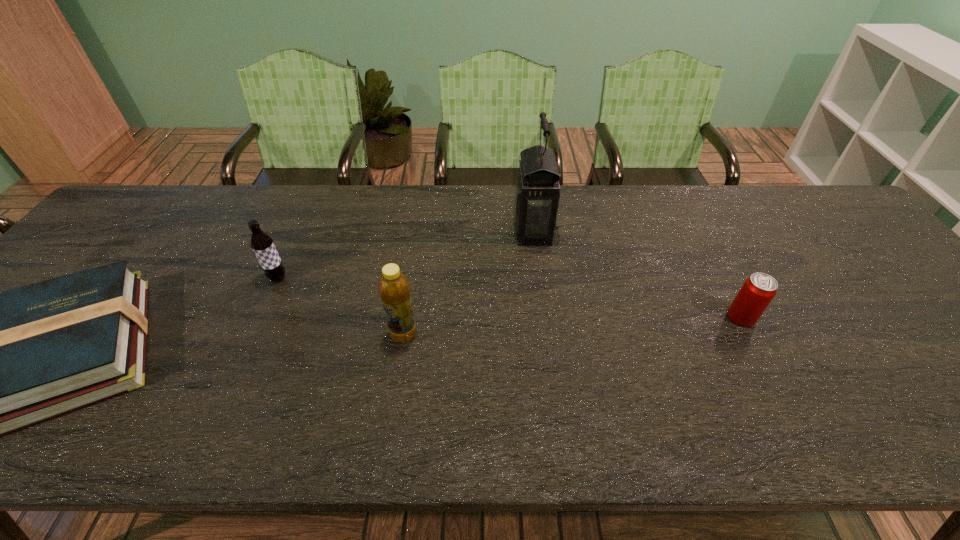
Locate an element on the screen. This screenshot has height=540, width=960. vacant area that lies between the second object from right to left and the fourth tallest object is located at coordinates (637, 274).

Find the location of `vacant area that lies between the lantern and the bottle`. vacant area that lies between the lantern and the bottle is located at coordinates (468, 282).

This screenshot has height=540, width=960. I want to click on vacant area that lies between the tallest object and the bottle, so click(468, 282).

Find the location of a particular element. free area in between the can and the bottle is located at coordinates (572, 326).

Identify the location of free spot between the tallest object and the third object from right to left. (468, 282).

Find the location of `empty space between the fourth object from left to right and the bottle`. empty space between the fourth object from left to right and the bottle is located at coordinates tap(468, 282).

The height and width of the screenshot is (540, 960). Find the location of `object that can be found as the second closest to the lantern`. object that can be found as the second closest to the lantern is located at coordinates (759, 289).

Choose which object is the second nearest neighbor to the root beer. Please provide its 2D coordinates. Your answer should be formatted as a tuple, i.e. [(x, y)], where the tuple contains the x and y coordinates of a point satisfying the conditions above.

[(394, 289)]

Locate an element on the screen. The image size is (960, 540). blank area in the image that satisfies the following two spatial constraints: 1. on the front-facing side of the can; 2. on the right side of the fourth object from left to right is located at coordinates (544, 317).